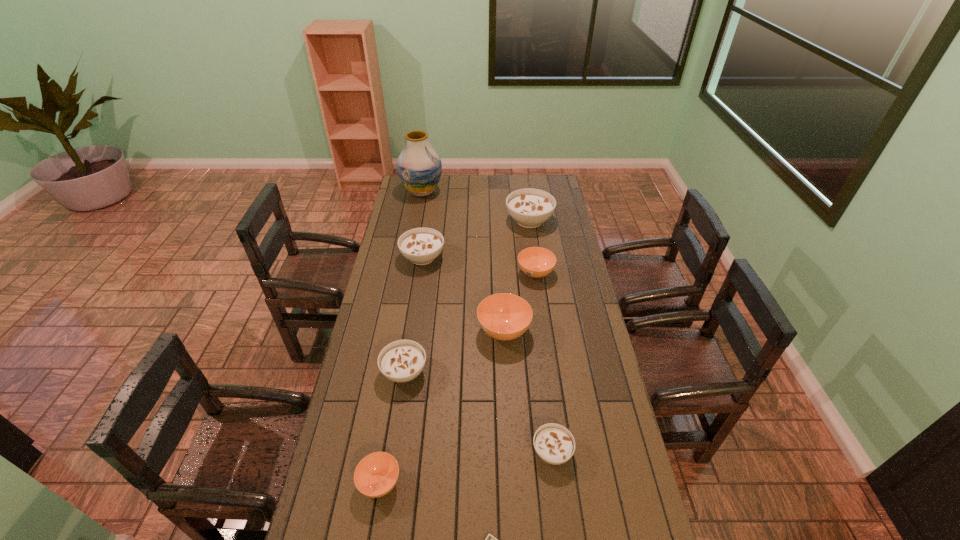
You are a GUI agent. You are given a task and a screenshot of the screen. Output one action in this format:
    pyautogui.click(x=<x>, y=<y>)
    Task: Click on the peach soup bowl that is the closest to the leftmost peach soup bowl
    Image resolution: width=960 pixels, height=540 pixels.
    Given the screenshot: What is the action you would take?
    pyautogui.click(x=503, y=316)

Locate an element on the screen. The width and height of the screenshot is (960, 540). peach soup bowl identified as the third closest to the vase is located at coordinates (376, 474).

Identify the location of blank space that satisfies the following two spatial constraints: 1. on the back side of the third nearest white soup bowl; 2. on the right side of the nearest peach soup bowl. coord(417,258).